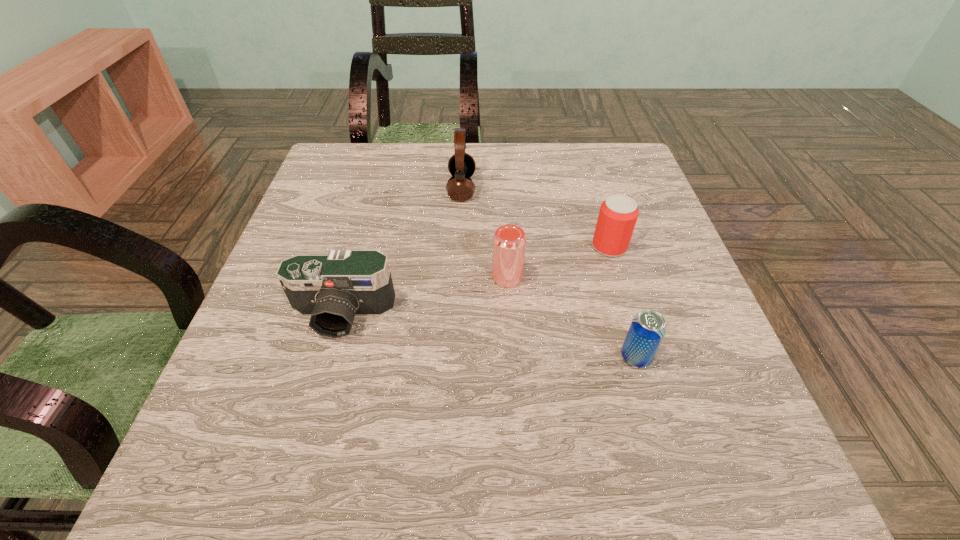
At what (x,y) coordinates should I click in order to perform the action: click on headset. Please return your answer as a coordinate pair (x, y). Looking at the image, I should click on (461, 165).

This screenshot has height=540, width=960. I want to click on the second object from left to right, so click(x=461, y=165).

Find the location of `the farthest beer can`. the farthest beer can is located at coordinates (618, 214).

Where is `the leftmost beer can`? Image resolution: width=960 pixels, height=540 pixels. the leftmost beer can is located at coordinates (509, 241).

Locate an element on the screen. The width and height of the screenshot is (960, 540). the second farthest beer can is located at coordinates (509, 241).

Find the location of `the fourth farthest object`. the fourth farthest object is located at coordinates (332, 289).

What are the coordinates of `camera` in the screenshot? It's located at (332, 289).

Locate an element on the screen. The image size is (960, 540). the nearest beer can is located at coordinates (648, 328).

You are a GUI agent. You are given a task and a screenshot of the screen. Output one action in this format:
    pyautogui.click(x=<x>, y=<y>)
    Task: Click on the vacant space situated on the ear pads of the farthest object
    The width and height of the screenshot is (960, 540).
    Given the screenshot: What is the action you would take?
    pyautogui.click(x=613, y=188)

The image size is (960, 540). I want to click on vacant space located 0.160m on the back of the farthest beer can, so pyautogui.click(x=593, y=193).